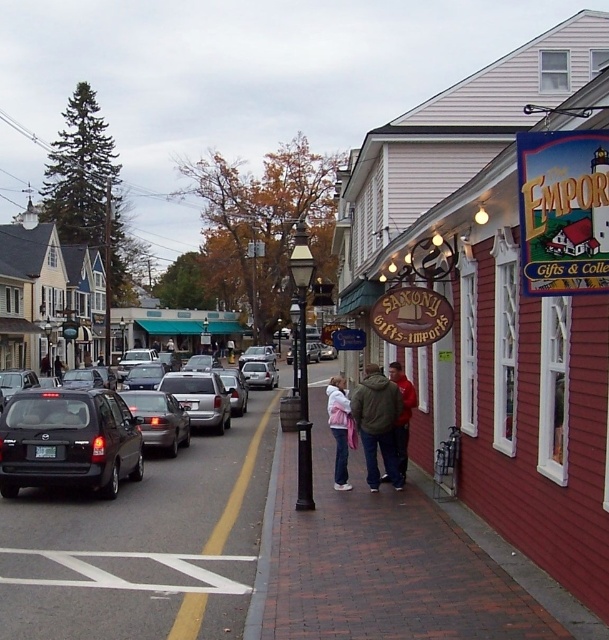
You are a pedestrian standing on the brick pavement at center and want to cross the street to reach the Emporium Gifts store on the right. Is the matte black sedan at left blocking your path?

The brick pavement at center is to the right of the matte black sedan at left, so the matte black sedan at left is not blocking your path to the Emporium Gifts store on the right.

You are standing at the center of the street looking towards the red building with the lighthouse sign. There is a point marked at coordinates (495, 301). What object is located at that point?

The red wooden sign at right is located at point (495, 301).

You are standing at the point marked by the coordinates point (389, 563) in the image. What type of surface are you currently standing on?

The point (389, 563) corresponds to brick pavement at center, so you are standing on brick pavement.